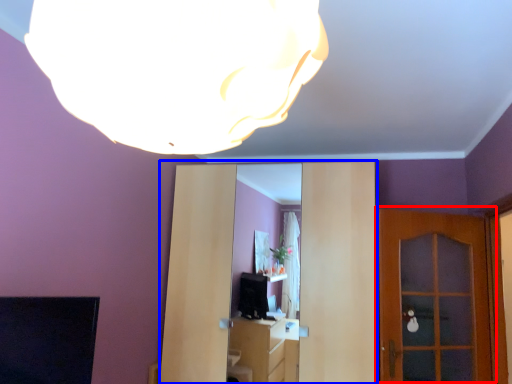
Question: Which object is further to the camera taking this photo, door (highlighted by a red box) or entertainment center (highlighted by a blue box)?

Choices:
 (A) door
 (B) entertainment center

Answer: (A)